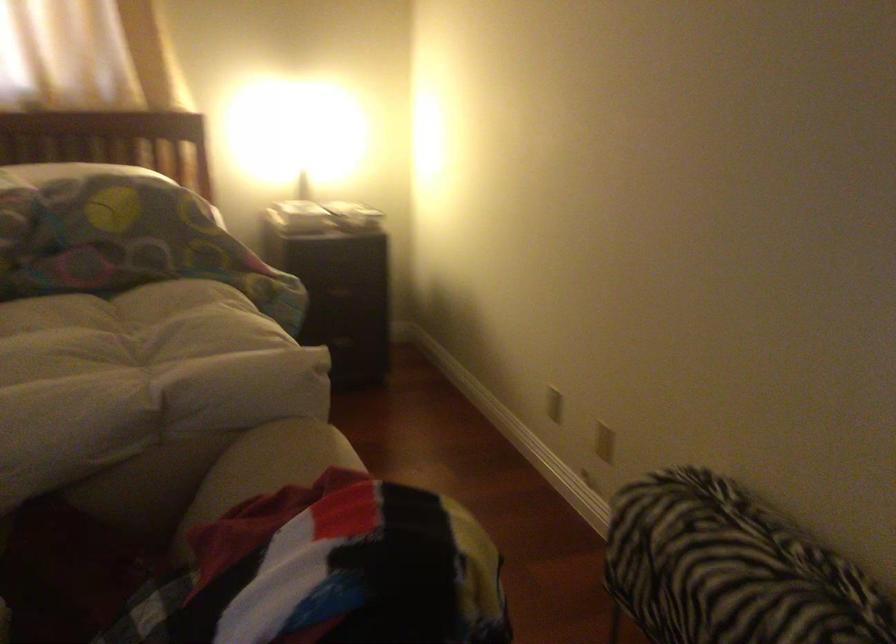
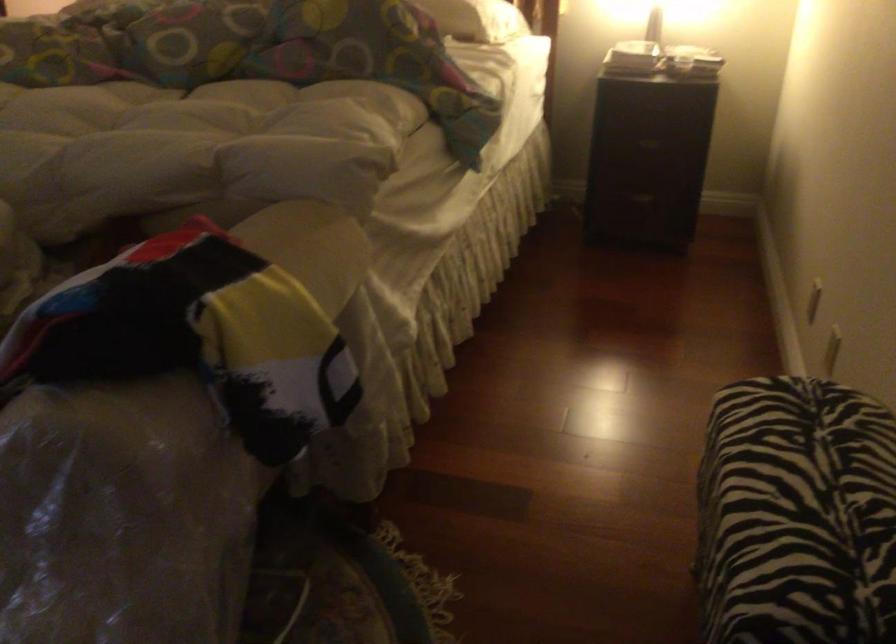
In the second image, find the point that corresponds to the point at 606,438 in the first image.

(831, 352)